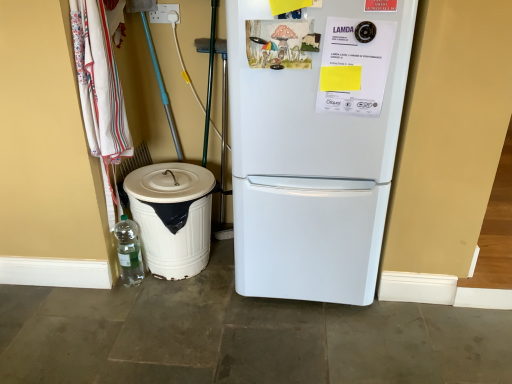
Question: From a real-world perspective, is white plastic electric outlet at upper center located higher than white plastic trash can at lower left?

Choices:
 (A) yes
 (B) no

Answer: (A)

Question: Can you confirm if white plastic electric outlet at upper center is thinner than white plastic trash can at lower left?

Choices:
 (A) no
 (B) yes

Answer: (B)

Question: Does white plastic electric outlet at upper center turn towards white plastic trash can at lower left?

Choices:
 (A) no
 (B) yes

Answer: (A)

Question: From the image's perspective, is white plastic electric outlet at upper center over white plastic trash can at lower left?

Choices:
 (A) no
 (B) yes

Answer: (B)

Question: Is white plastic electric outlet at upper center completely or partially outside of white plastic trash can at lower left?

Choices:
 (A) no
 (B) yes

Answer: (B)

Question: Considering the relative sizes of white plastic electric outlet at upper center and white plastic trash can at lower left in the image provided, is white plastic electric outlet at upper center wider than white plastic trash can at lower left?

Choices:
 (A) yes
 (B) no

Answer: (B)

Question: From the image's perspective, is clear plastic bottle at lower left above white plastic trash can at lower left?

Choices:
 (A) no
 (B) yes

Answer: (A)

Question: Can you confirm if clear plastic bottle at lower left is positioned to the right of white plastic trash can at lower left?

Choices:
 (A) yes
 (B) no

Answer: (B)

Question: Can you confirm if clear plastic bottle at lower left is positioned to the left of white plastic trash can at lower left?

Choices:
 (A) yes
 (B) no

Answer: (A)

Question: Does clear plastic bottle at lower left have a greater height compared to white plastic trash can at lower left?

Choices:
 (A) no
 (B) yes

Answer: (A)

Question: Can you see clear plastic bottle at lower left touching white plastic trash can at lower left?

Choices:
 (A) no
 (B) yes

Answer: (A)

Question: Is clear plastic bottle at lower left not within white plastic trash can at lower left?

Choices:
 (A) yes
 (B) no

Answer: (B)

Question: Does white plastic trash can at lower left appear on the left side of white fabric laundry at left?

Choices:
 (A) yes
 (B) no

Answer: (B)